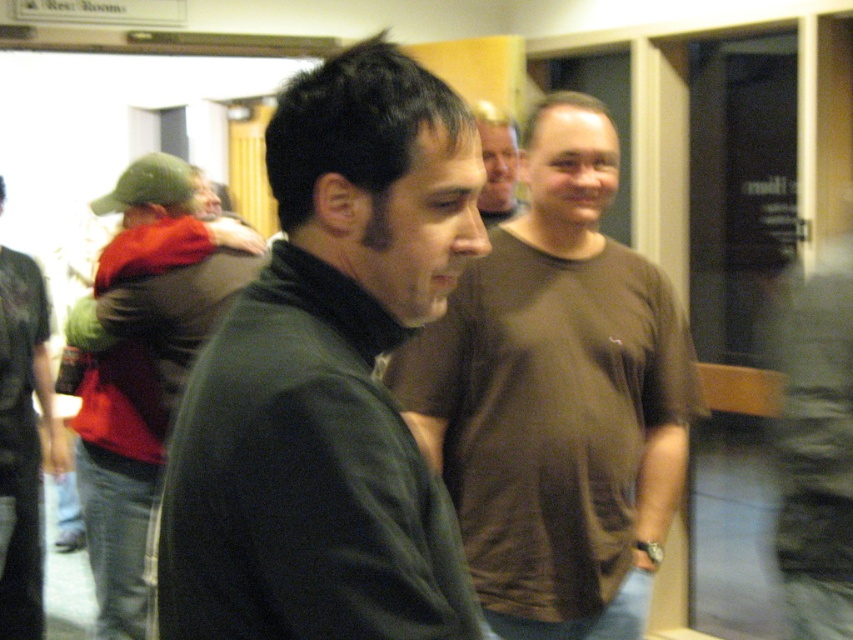
You are at a social gathering and want to know which person is shorter between the dark green sweater at center and the dark gray sweater at left. Which one is shorter?

The dark green sweater at center is shorter than the dark gray sweater at left.